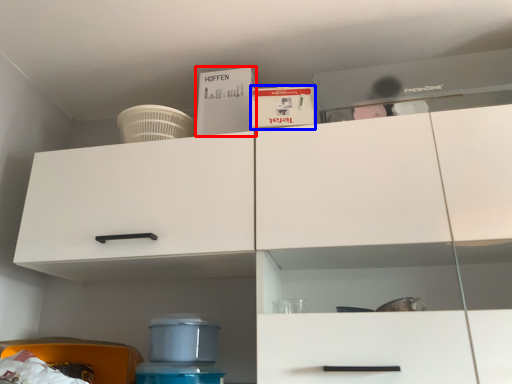
Question: Which object is closer to the camera taking this photo, box (highlighted by a red box) or box (highlighted by a blue box)?

Choices:
 (A) box
 (B) box

Answer: (B)